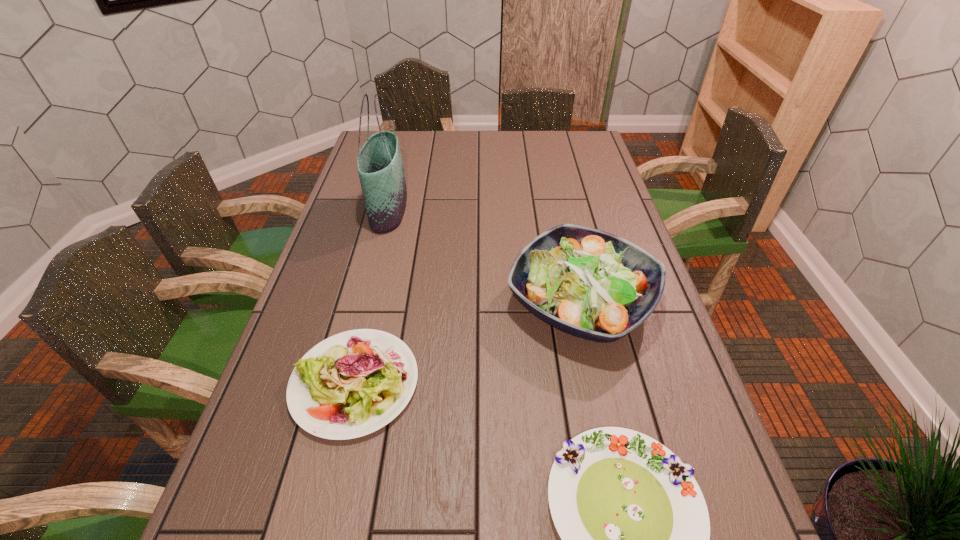
Where is `object present at the right edge`? This screenshot has width=960, height=540. object present at the right edge is located at coordinates (592, 284).

You are a GUI agent. You are given a task and a screenshot of the screen. Output one action in this format:
    pyautogui.click(x=<x>, y=<y>)
    Task: Click on the free spot at the far edge of the desktop
    The height and width of the screenshot is (540, 960).
    Given the screenshot: What is the action you would take?
    pyautogui.click(x=418, y=140)

Find the location of `vacant space at the left edge of the desktop`. vacant space at the left edge of the desktop is located at coordinates (337, 253).

Locate an element on the screen. The image size is (960, 540). vacant point at the right edge is located at coordinates (637, 382).

Where is `blank region between the third shortest object and the tallest object`? This screenshot has height=540, width=960. blank region between the third shortest object and the tallest object is located at coordinates (485, 256).

Locate an element on the screen. This screenshot has height=540, width=960. vacant space that's between the third shortest object and the leftmost salad plate is located at coordinates pyautogui.click(x=468, y=343).

What are the coordinates of `free space between the tallest salad plate and the tallest object` in the screenshot? It's located at (485, 256).

Identify the location of free space between the second tallest salad plate and the third shortest object. The width and height of the screenshot is (960, 540). (468, 343).

Identify the location of vacant area that lies between the second shortest salad plate and the tallest salad plate. (468, 343).

This screenshot has width=960, height=540. In order to click on free space between the tallest object and the second tallest object in this screenshot , I will do tap(485, 256).